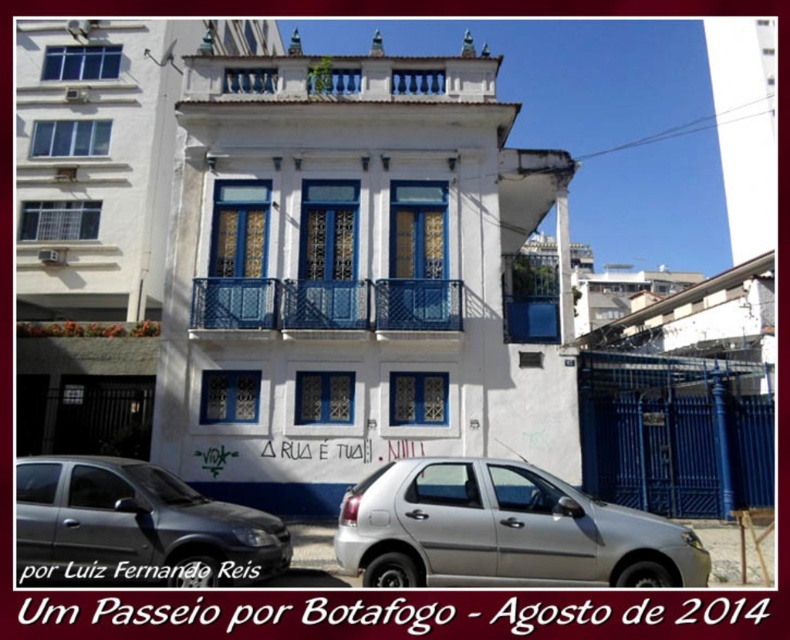
You are a delivery driver who needs to park your vehicle between the two cars in front of the building. Your car is 4.5 meters long. Can you fit your car between the silver metallic hatchback at center and the satin silver car at lower left?

Answer: The silver metallic hatchback at center is to the right of the satin silver car at lower left. Since the distance between them isn

Looking at this image, you are a delivery driver who needs to park your car next to the blue metal railing at center. The silver metallic hatchback at center is currently blocking the spot. Can you drive around it to the left or the right to reach the desired parking spot?

The silver metallic hatchback at center is to the right of the blue metal railing at center, so you can drive around to the left side of the silver metallic hatchback at center to reach the parking spot next to the blue metal railing at center.

You are a delivery person who needs to park your van, which is 2 meters tall, in the parking lot near the white building. The parking spot is between the silver metallic hatchback at center and the blue metal railing at center. Can your van fit vertically between them?

The silver metallic hatchback at center is taller than the blue metal railing at center. Since your van is 2 meters tall, you need to ensure there is enough vertical space between them. However, without knowing the exact distance between the hatchback and the railing, it is impossible to determine if the van will fit.